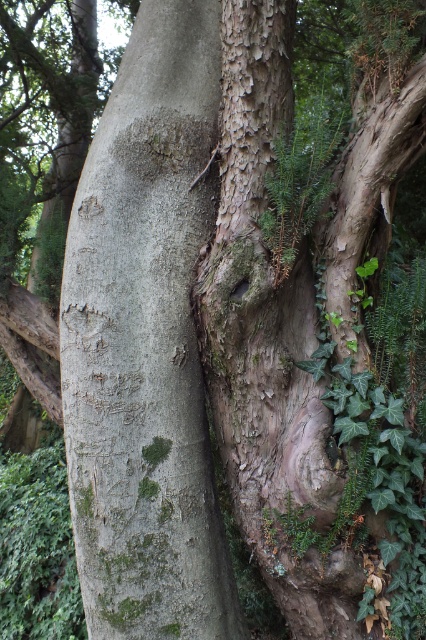
Question: Which point is closer to the camera?

Choices:
 (A) green mossy bark at center
 (B) smooth bark tree trunk at center

Answer: (B)

Question: Which of the following is the closest to the observer?

Choices:
 (A) [265, 269]
 (B) [222, 602]

Answer: (A)

Question: Is green mossy bark at center to the left of smooth bark tree trunk at center from the viewer's perspective?

Choices:
 (A) no
 (B) yes

Answer: (B)

Question: Does green mossy bark at center have a lesser width compared to smooth bark tree trunk at center?

Choices:
 (A) yes
 (B) no

Answer: (B)

Question: Which of the following is the farthest from the observer?

Choices:
 (A) smooth bark tree trunk at center
 (B) green mossy bark at center

Answer: (B)

Question: Observing the image, what is the correct spatial positioning of green mossy bark at center in reference to smooth bark tree trunk at center?

Choices:
 (A) right
 (B) left

Answer: (B)